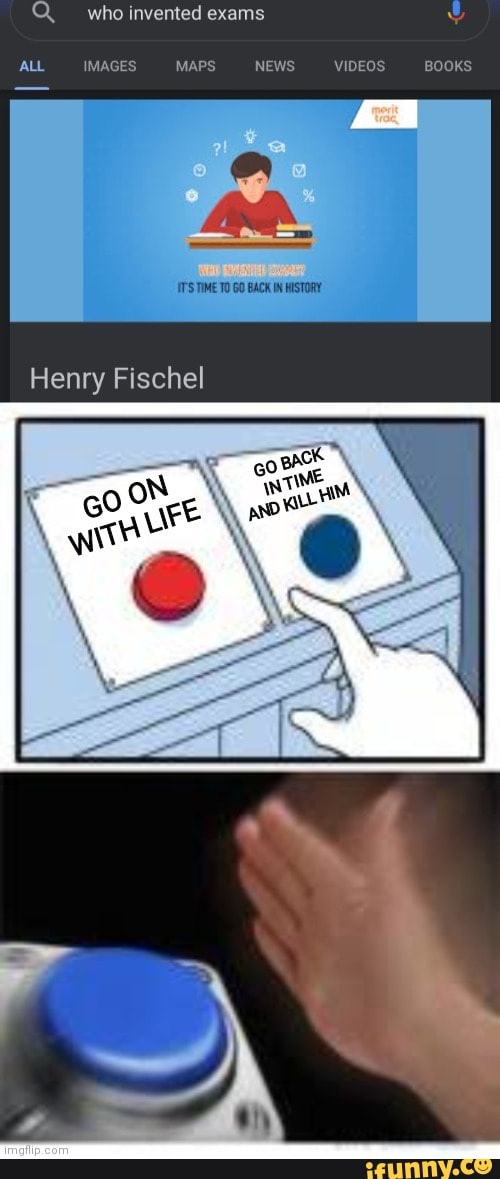
Where is `grey counter`? grey counter is located at coordinates (265, 674).